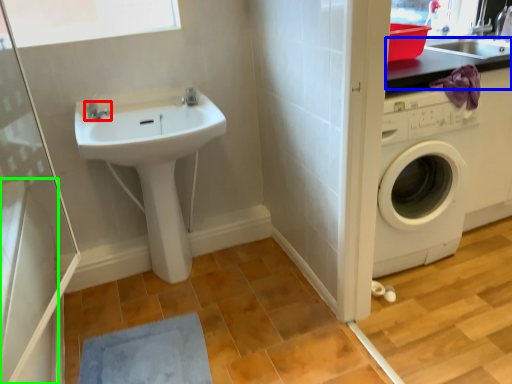
Question: Which is nearer to the tap (highlighted by a red box)? counter top (highlighted by a blue box) or appliance (highlighted by a green box).

Choices:
 (A) counter top
 (B) appliance

Answer: (B)